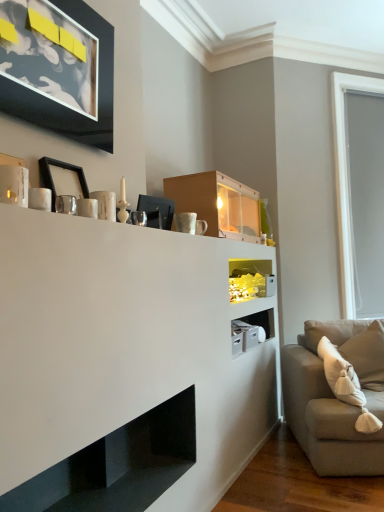
This screenshot has height=512, width=384. What are the coordinates of `free space above gray matte window screen at right (from a real-world perspective)` in the screenshot? It's located at (361, 74).